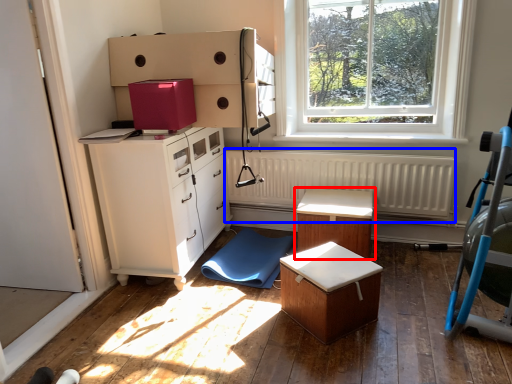
Question: Which object appears closest to the camera in this image, table (highlighted by a red box) or radiator (highlighted by a blue box)?

Choices:
 (A) table
 (B) radiator

Answer: (A)